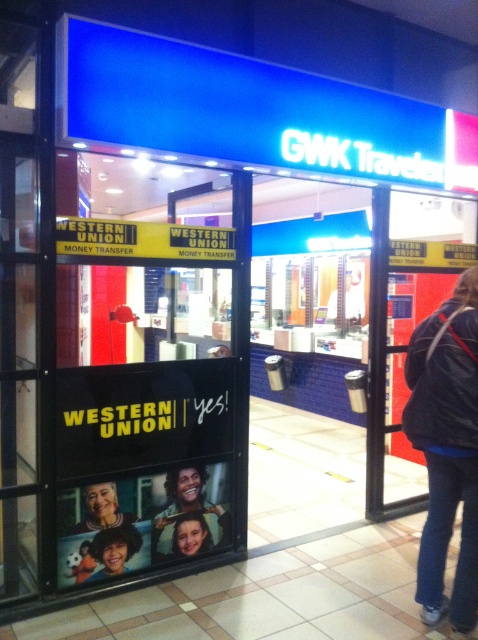
Question: Which point is closer to the camera taking this photo?

Choices:
 (A) (99, 497)
 (B) (122, 556)

Answer: (A)

Question: Which point is closer to the camera?

Choices:
 (A) yellow/black sign at upper center
 (B) smooth skin face at lower left

Answer: (A)

Question: Which object is the farthest from the smooth skin face at lower left?

Choices:
 (A) yellow/black sign at upper center
 (B) transparent glass door at left
 (C) curly-haired boy at lower left

Answer: (A)

Question: Can you confirm if curly-haired boy at lower left is positioned above smooth skin face at lower center?

Choices:
 (A) yes
 (B) no

Answer: (A)

Question: Is transparent glass door at left to the right of curly-haired boy at lower left from the viewer's perspective?

Choices:
 (A) no
 (B) yes

Answer: (A)

Question: Considering the relative positions of curly-haired boy at lower left and smooth skin face at lower center in the image provided, where is curly-haired boy at lower left located with respect to smooth skin face at lower center?

Choices:
 (A) below
 (B) above

Answer: (B)